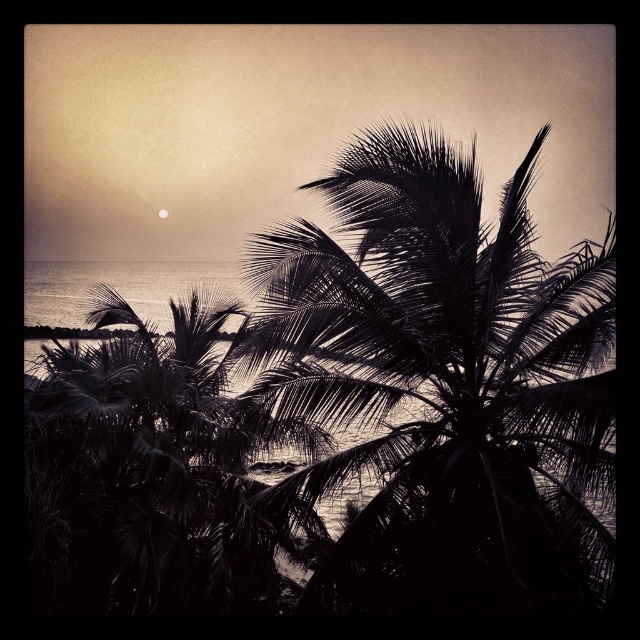
Question: Among these points, which one is farthest from the camera?

Choices:
 (A) (164, 212)
 (B) (403, 477)

Answer: (A)

Question: Observing the image, what is the correct spatial positioning of black leafy palm at center in reference to silvery metallic moon at upper center?

Choices:
 (A) left
 (B) right

Answer: (B)

Question: Does black leafy palm at center appear on the left side of silvery metallic moon at upper center?

Choices:
 (A) yes
 (B) no

Answer: (B)

Question: Which of the following is the closest to the observer?

Choices:
 (A) (480, 394)
 (B) (161, 209)

Answer: (A)

Question: Is black leafy palm at center behind silvery metallic moon at upper center?

Choices:
 (A) no
 (B) yes

Answer: (A)

Question: Which point is closer to the camera?

Choices:
 (A) (372, 166)
 (B) (164, 211)

Answer: (A)